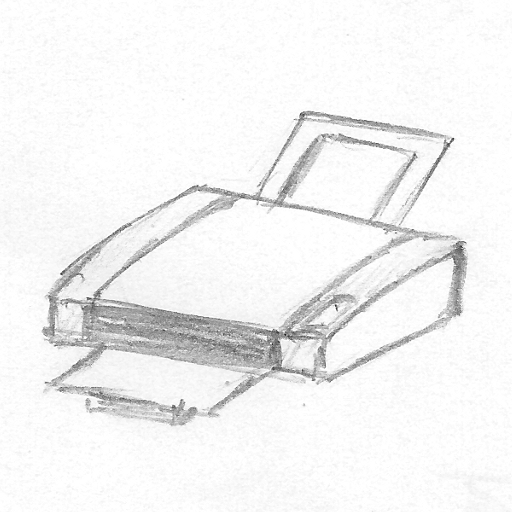
Locate an element on the screen. sheets of paper is located at coordinates (340, 181), (181, 385).